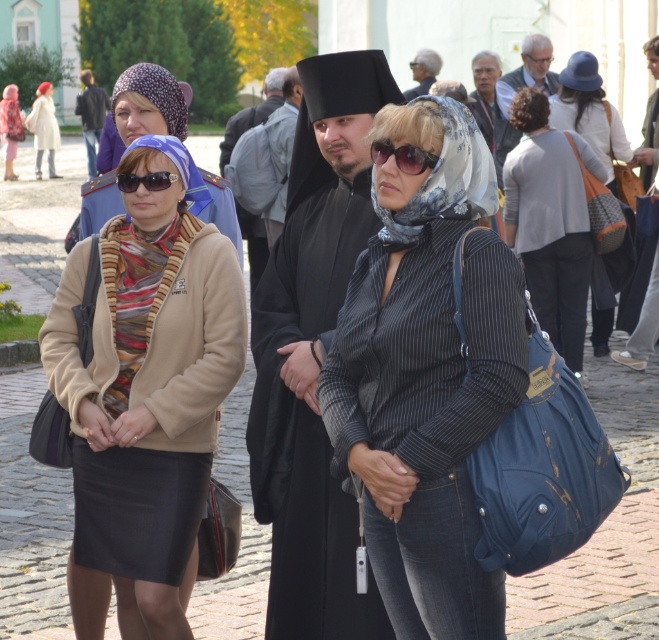
You are standing in the public square and want to determine which of the two points, point [646,316] or point [517,76], is closer to you. Based on the scene, which point is nearer?

Point [646,316] is closer to the viewer than point [517,76].

You are a photographer trying to capture a candid shot of the gray hair at upper center without the knitted orange bag at center blocking the view. Is the bag currently in a position that would obstruct your shot?

The knitted orange bag at center is positioned under gray hair at upper center, so it is below the gray hair and would not obstruct the view of the gray hair.

You are a photographer setting up for a group photo in the square. You have two items to position correctly for the shot. The striped fabric scarf at center and the matte black sunglasses at center must be placed in such a way that they are exactly 2 meters apart. Based on the current distance between them, will you need to move them closer or farther apart to achieve the desired spacing?

The striped fabric scarf at center is currently 1.83 meters away from the matte black sunglasses at center. To reach the desired 2 meters, you need to move them farther apart by approximately 0.17 meters.